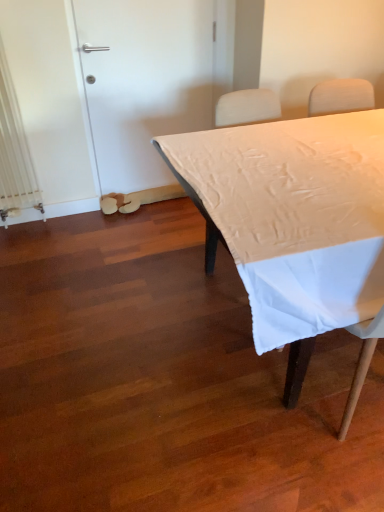
Question: Is white matte door at upper left to the left or to the right of white matte table at center in the image?

Choices:
 (A) left
 (B) right

Answer: (A)

Question: Looking at the image, does white matte door at upper left seem bigger or smaller compared to white matte table at center?

Choices:
 (A) small
 (B) big

Answer: (A)

Question: From the image's perspective, is white matte door at upper left positioned above or below white matte table at center?

Choices:
 (A) below
 (B) above

Answer: (B)

Question: Looking at their shapes, would you say white matte table at center is wider or thinner than white matte door at upper left?

Choices:
 (A) wide
 (B) thin

Answer: (A)

Question: Based on their sizes in the image, would you say white matte table at center is bigger or smaller than white matte door at upper left?

Choices:
 (A) big
 (B) small

Answer: (A)

Question: In the image, is white matte table at center positioned in front of or behind white matte door at upper left?

Choices:
 (A) front
 (B) behind

Answer: (A)

Question: Is white matte table at center inside the boundaries of white matte door at upper left, or outside?

Choices:
 (A) inside
 (B) outside

Answer: (B)